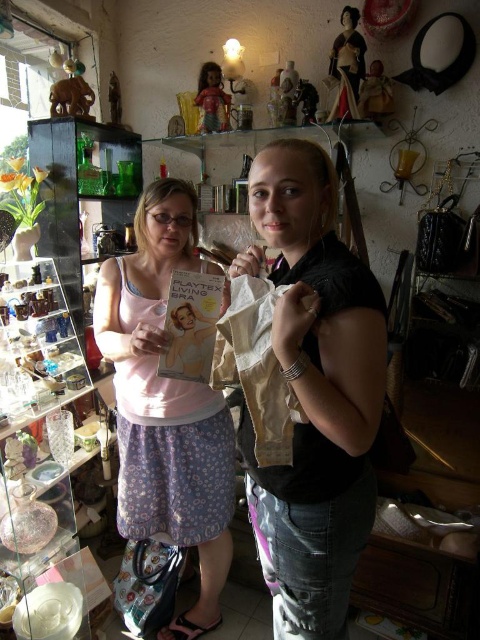
Question: Is matte beige lingerie at center smaller than porcelain figurine at upper center?

Choices:
 (A) no
 (B) yes

Answer: (A)

Question: Considering the real-world distances, which object is closest to the matte brown figurine at upper left?

Choices:
 (A) pink fabric bra at left
 (B) porcelain figurine at upper center
 (C) matte beige lingerie at center

Answer: (B)

Question: Which object is closer to the camera taking this photo?

Choices:
 (A) matte beige lingerie at center
 (B) porcelain figurine at upper center
 (C) wooden figurine at upper right
 (D) matte brown figurine at upper left

Answer: (A)

Question: Which point is farther to the camera?

Choices:
 (A) porcelain figurine at upper center
 (B) pink fabric bra at left
 (C) wooden figurine at upper right
 (D) matte plastic doll at upper center

Answer: (D)

Question: Is matte beige lingerie at center closer to the viewer compared to wooden figurine at upper right?

Choices:
 (A) no
 (B) yes

Answer: (B)

Question: Is matte beige lingerie at center below porcelain figurine at upper center?

Choices:
 (A) yes
 (B) no

Answer: (A)